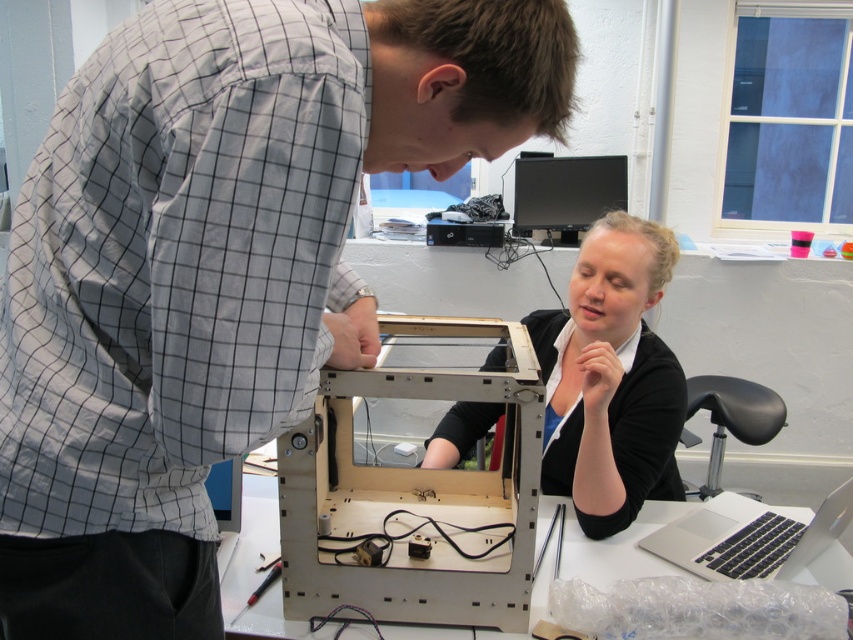
Question: From the image, what is the correct spatial relationship of metallic silver electronics at center in relation to black glossy monitor at upper center?

Choices:
 (A) below
 (B) above

Answer: (A)

Question: Where is metallic silver electronics at center located in relation to black matte laptop at center in the image?

Choices:
 (A) right
 (B) left

Answer: (B)

Question: Estimate the real-world distances between objects in this image. Which object is closer to the white matte wooden frame at center?

Choices:
 (A) silver metallic laptop at lower right
 (B) metallic silver electronics at center
 (C) black glossy monitor at upper center

Answer: (B)

Question: Considering the real-world distances, which object is farthest from the white matte wooden frame at center?

Choices:
 (A) black glossy monitor at upper center
 (B) white plastic table at center

Answer: (A)

Question: Among these objects, which one is nearest to the camera?

Choices:
 (A) black matte laptop at center
 (B) white matte wooden frame at center

Answer: (B)

Question: Observing the image, what is the correct spatial positioning of black matte laptop at center in reference to black glossy monitor at upper center?

Choices:
 (A) right
 (B) left

Answer: (B)